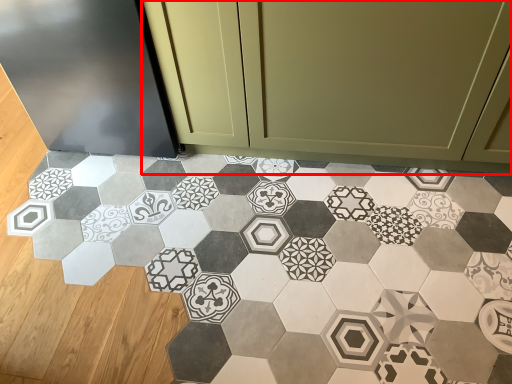
Question: From the image, what is the correct spatial relationship of cabinetry (annotated by the red box) in relation to porcelain?

Choices:
 (A) right
 (B) left

Answer: (A)